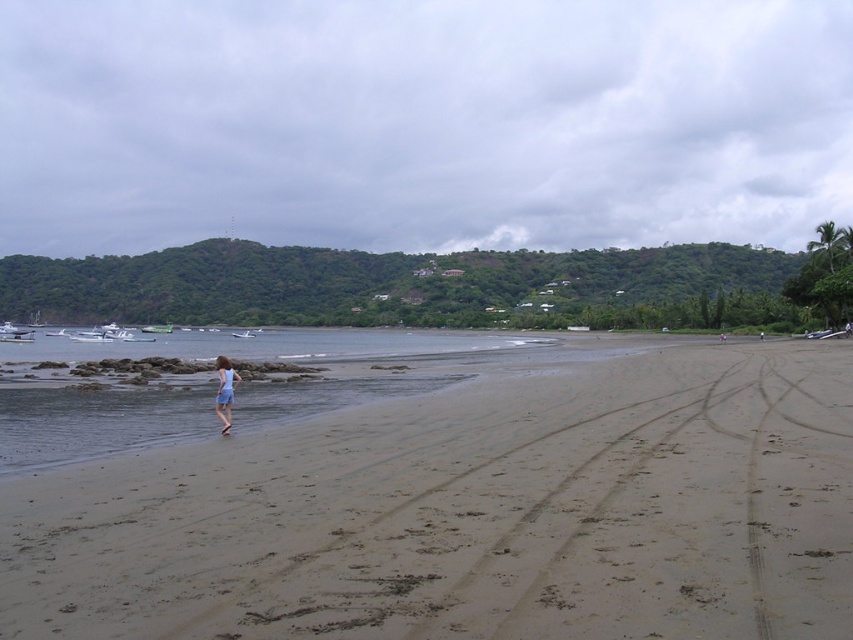
Question: Which point is closer to the camera?

Choices:
 (A) (318, 493)
 (B) (219, 376)

Answer: (A)

Question: Does sandy beach at lower left have a smaller size compared to light blue fabric dress at center?

Choices:
 (A) no
 (B) yes

Answer: (A)

Question: Is sandy beach at lower left above light blue fabric dress at center?

Choices:
 (A) yes
 (B) no

Answer: (B)

Question: Which object appears farthest from the camera in this image?

Choices:
 (A) sandy beach at lower left
 (B) light blue fabric dress at center

Answer: (B)

Question: Is sandy beach at lower left smaller than light blue fabric dress at center?

Choices:
 (A) no
 (B) yes

Answer: (A)